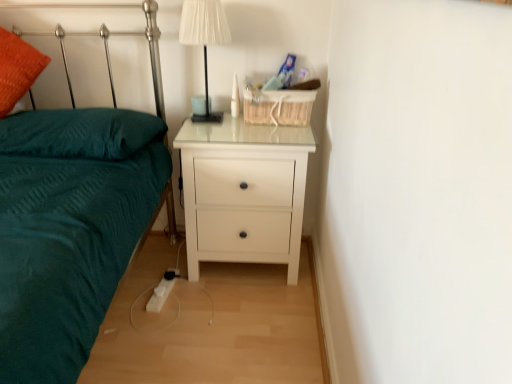
Where is `vacant space underneath white fabric lampshade at upper center (from a real-world perspective)`? Image resolution: width=512 pixels, height=384 pixels. vacant space underneath white fabric lampshade at upper center (from a real-world perspective) is located at coordinates (212, 113).